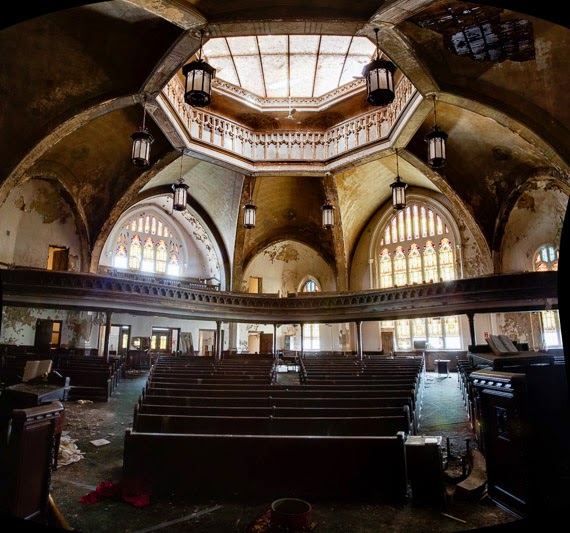
The image size is (570, 533). Find the location of `chairs`. chairs is located at coordinates (240, 413).